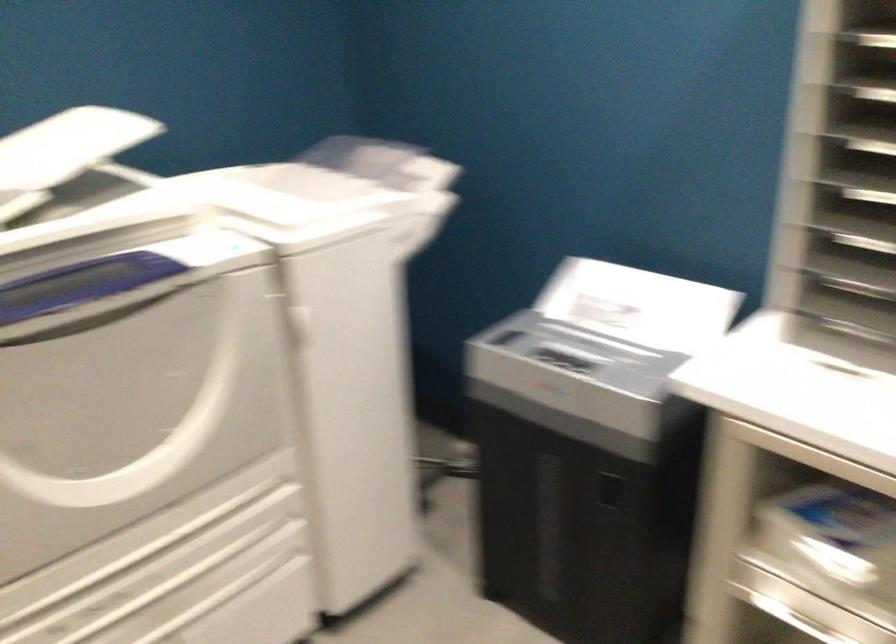
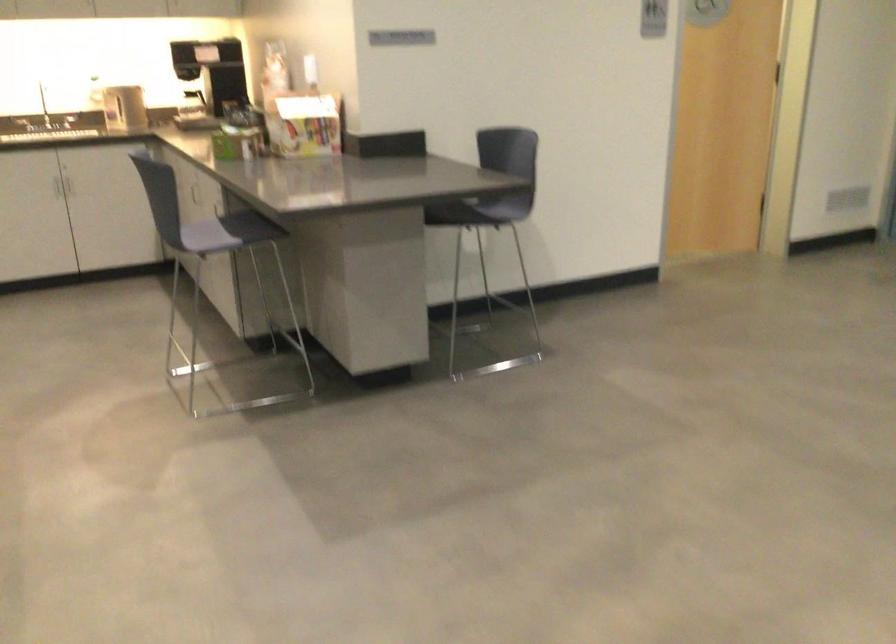
The first image is from the beginning of the video and the second image is from the end. How did the camera likely rotate when shooting the video?

The camera rotated toward left-down.